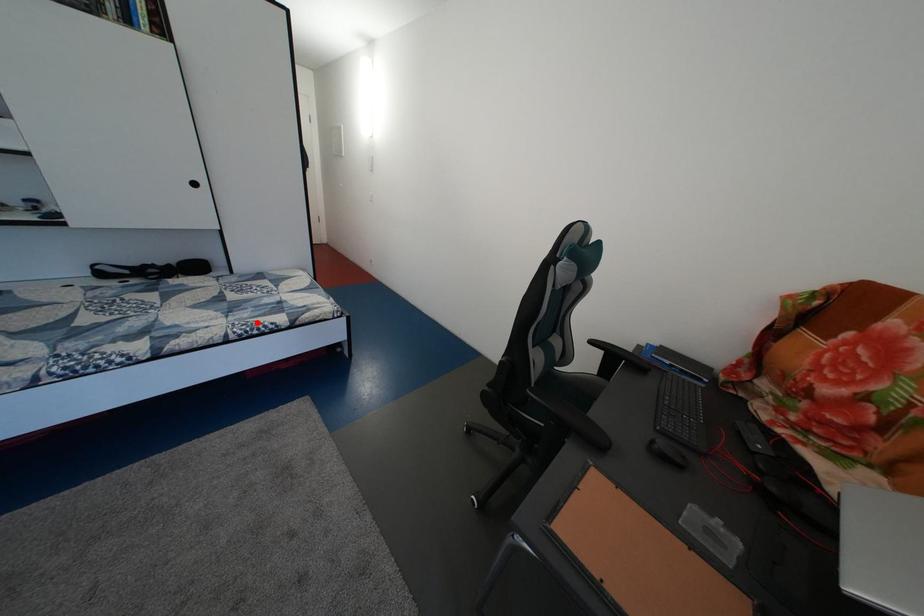
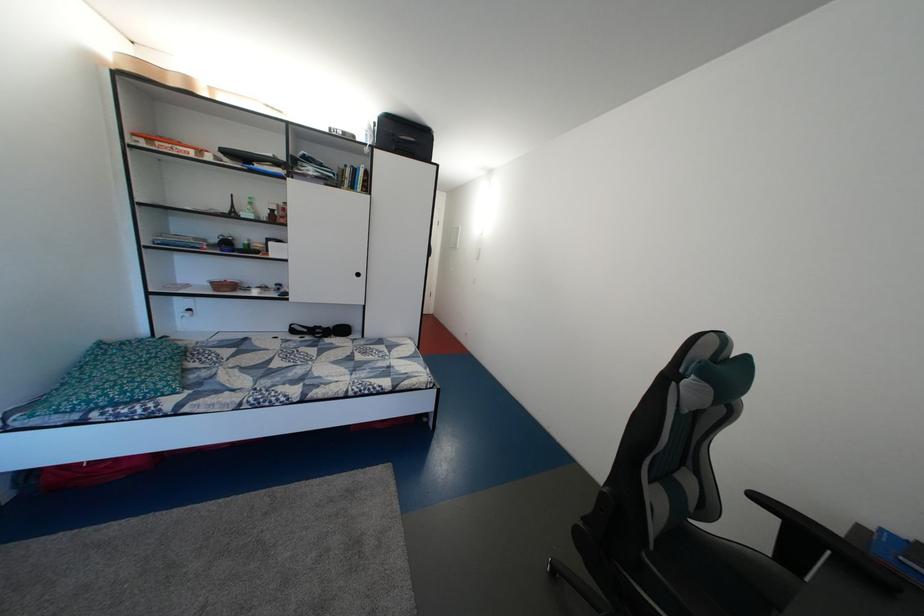
Find the pixel in the second image that matches the highlighted location in the first image.

(373, 382)